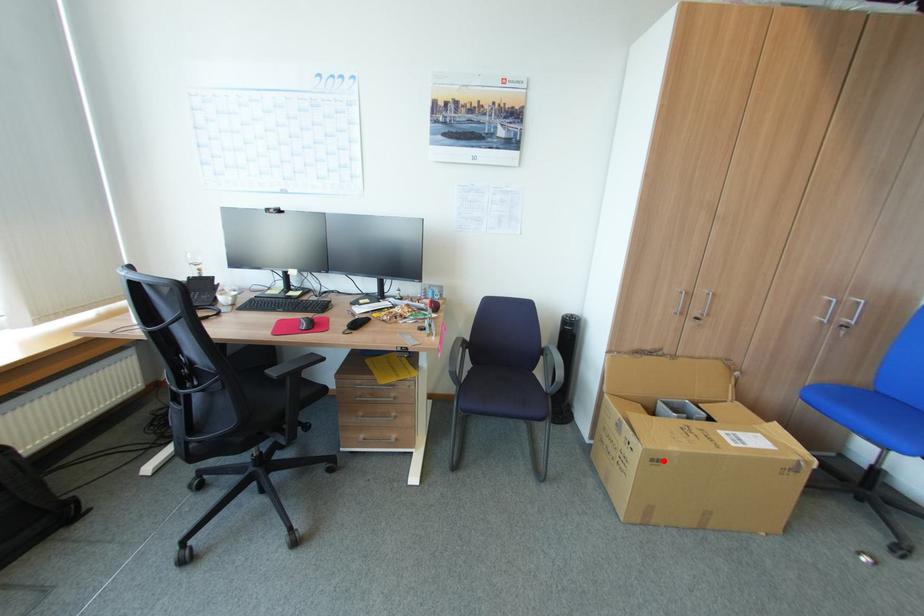
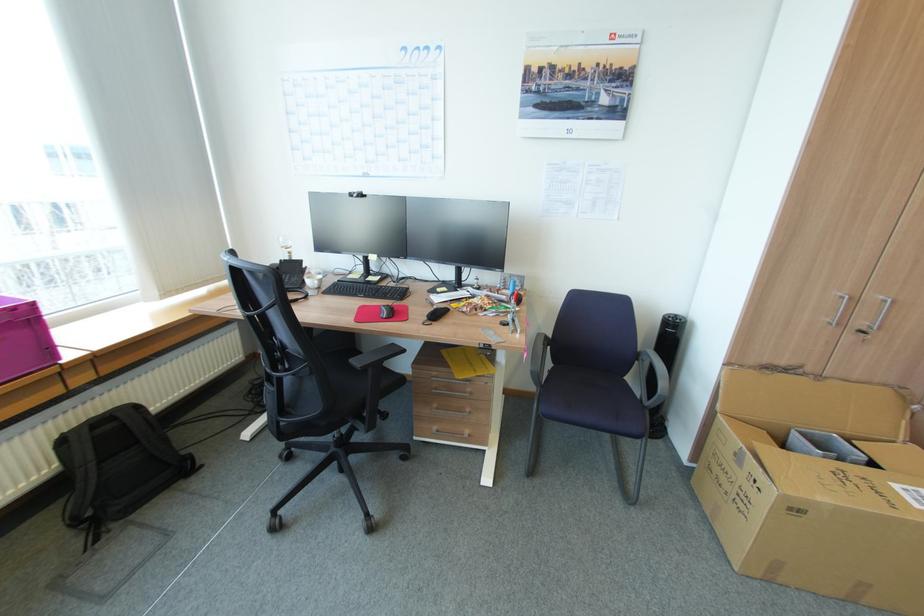
Question: I am providing you with two images of the same scene from different viewpoints. A red point is shown in image1. For the corresponding object point in image2, is it positioned nearer or farther from the camera?

Choices:
 (A) Nearer
 (B) Farther

Answer: (A)